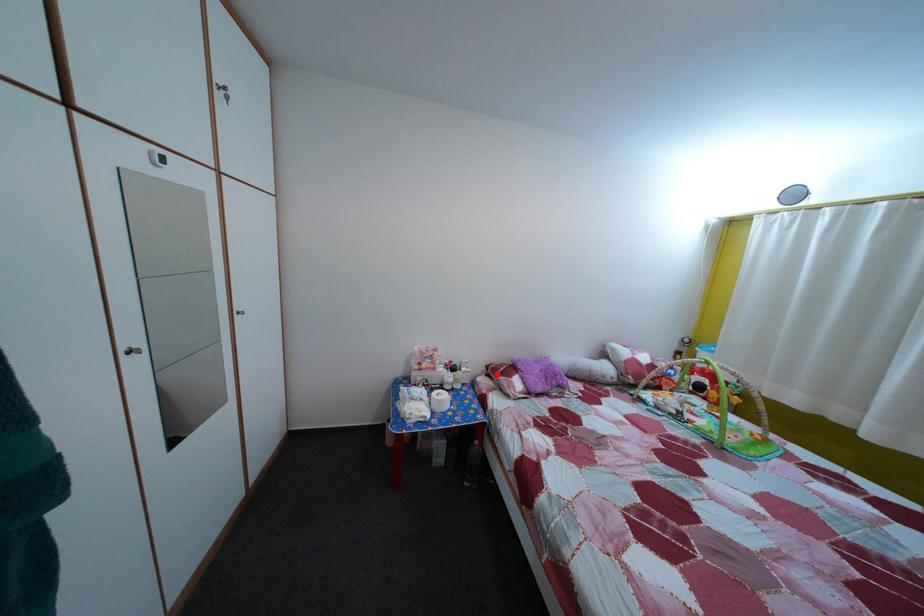
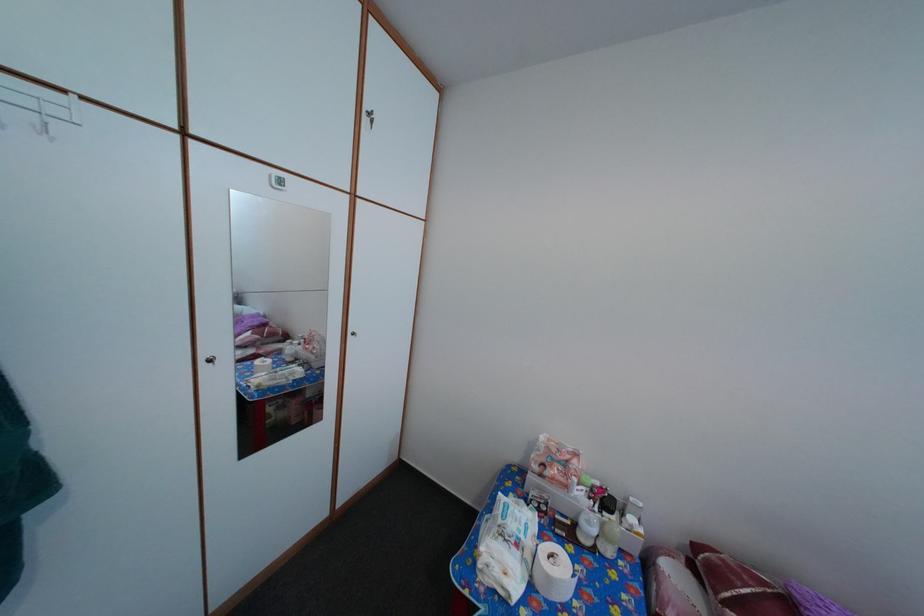
Where in the second image is the point corresponding to the highlighted location from the first image?

(704, 554)